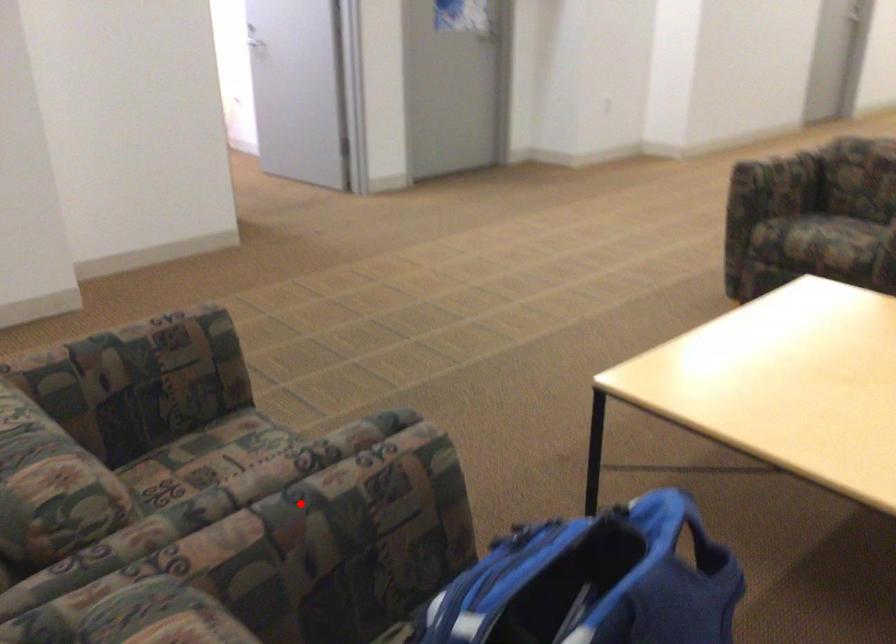
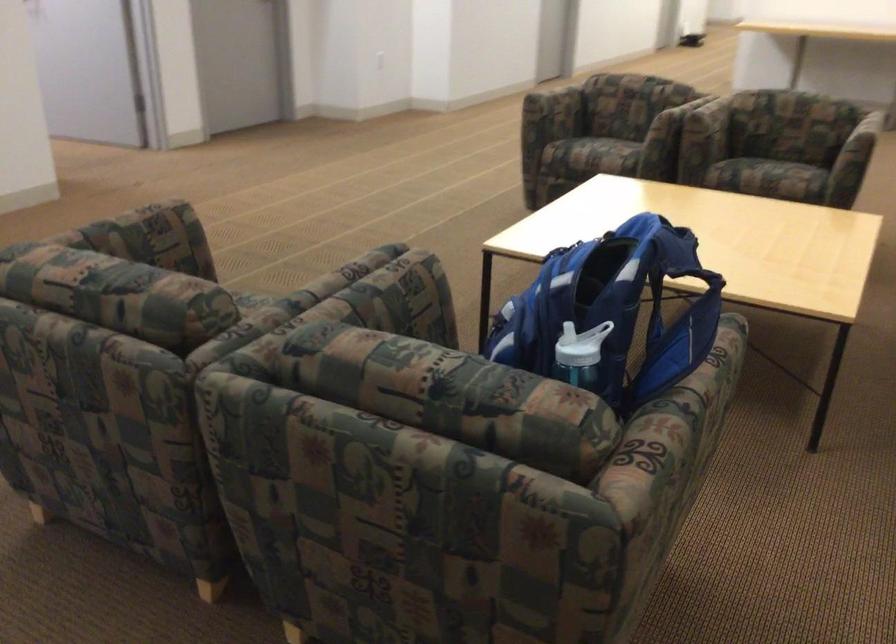
Question: A red point is marked in image1. In image2, is the corresponding 3D point closer to the camera or farther? Reply with the corresponding letter.

Choices:
 (A) The corresponding 3D point is closer.
 (B) The corresponding 3D point is farther.

Answer: (B)